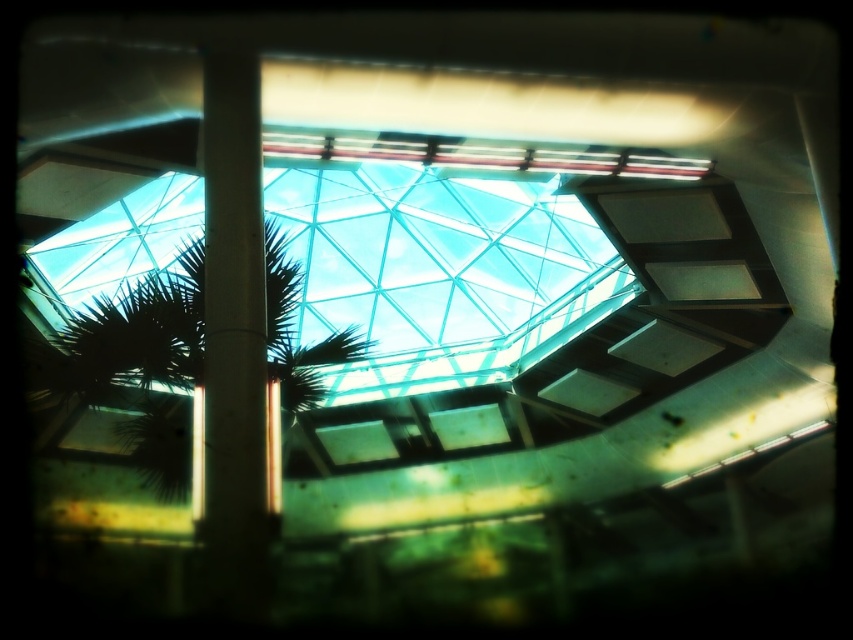
Is green leafy palm tree at center to the right of smooth concrete pillar at center from the viewer's perspective?

Incorrect, green leafy palm tree at center is not on the right side of smooth concrete pillar at center.

Can you confirm if green leafy palm tree at center is shorter than smooth concrete pillar at center?

Incorrect, green leafy palm tree at center's height does not fall short of smooth concrete pillar at center's.

Does point (277, 483) come in front of point (230, 404)?

No, it is behind (230, 404).

What are the coordinates of `green leafy palm tree at center` in the screenshot? It's located at (137, 365).